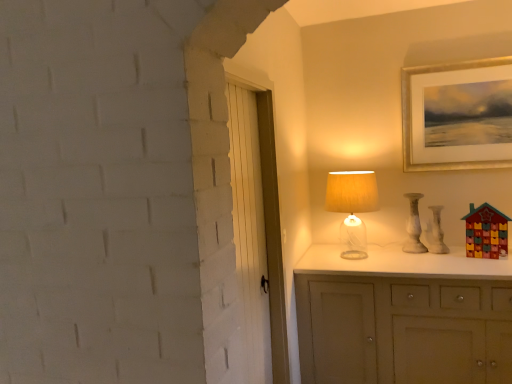
Identify the location of free space above gold-framed picture at upper right (from a real-world perspective). (454, 65).